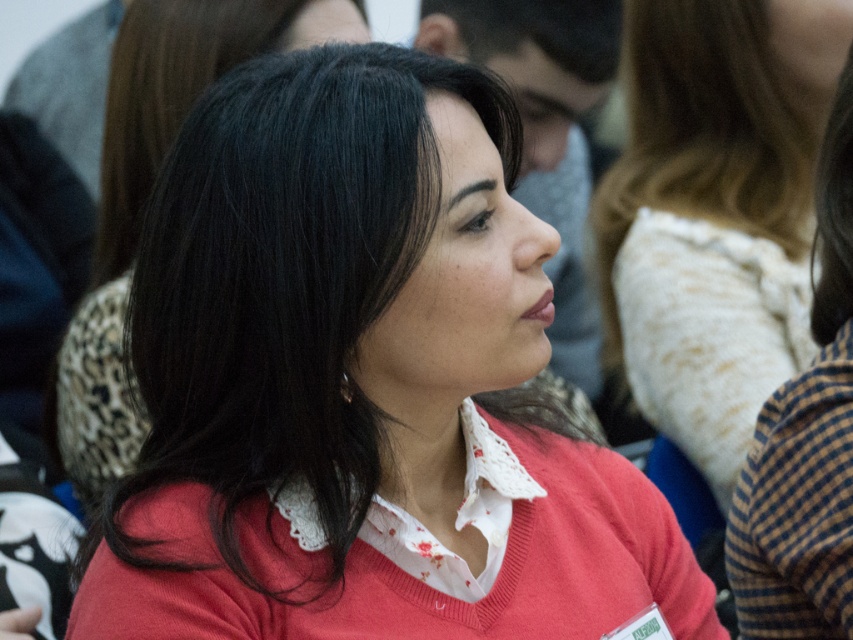
Find the location of a particular element. white lace shirt at center is located at coordinates (715, 211).

Which is in front, point (744, 49) or point (788, 573)?

Point (788, 573)

I want to click on white lace shirt at center, so click(715, 211).

In the scene shown: Does black smooth hair at center have a lesser width compared to black silky hair at upper right?

No, black smooth hair at center is not thinner than black silky hair at upper right.

Is black smooth hair at center wider than black silky hair at upper right?

Yes, black smooth hair at center is wider than black silky hair at upper right.

Locate an element on the screen. The height and width of the screenshot is (640, 853). black smooth hair at center is located at coordinates (184, 90).

Is blue checkered shirt at right taller than black silky hair at upper right?

Correct, blue checkered shirt at right is much taller as black silky hair at upper right.

Consider the image. Who is more distant from viewer, (759, 604) or (848, 161)?

The point (759, 604) is behind.

Find the location of a particular element. blue checkered shirt at right is located at coordinates (805, 442).